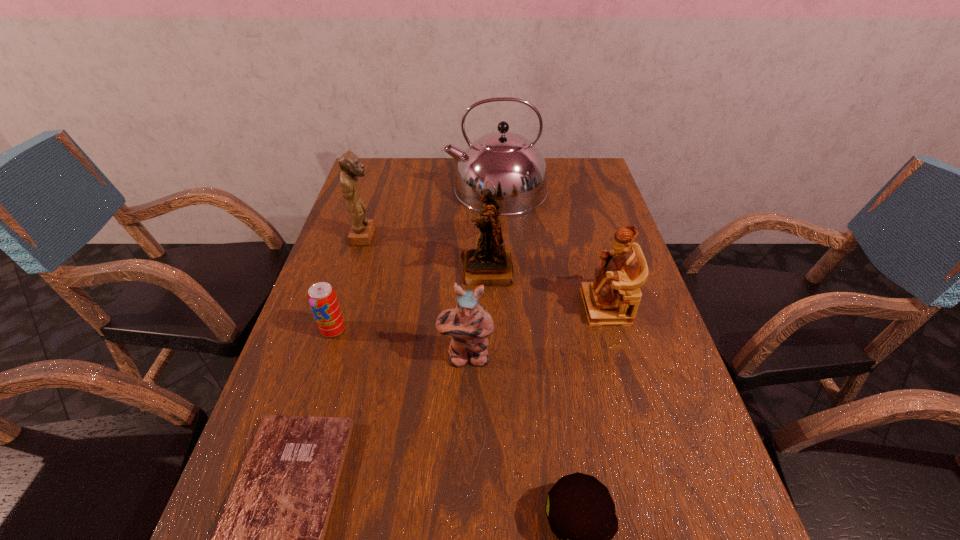
Image resolution: width=960 pixels, height=540 pixels. In order to click on blank space located on the front-facing side of the rightmost figurine in this screenshot , I will do `click(532, 307)`.

This screenshot has height=540, width=960. Find the location of `vacant space located 0.240m on the front-facing side of the rightmost figurine`. vacant space located 0.240m on the front-facing side of the rightmost figurine is located at coordinates (487, 307).

You are a GUI agent. You are given a task and a screenshot of the screen. Output one action in this format:
    pyautogui.click(x=<x>, y=<y>)
    Task: Click on the vacant space located on the front-facing side of the rightmost figurine
    The height and width of the screenshot is (540, 960).
    Given the screenshot: What is the action you would take?
    pyautogui.click(x=451, y=307)

What are the coordinates of `free spot located 0.260m on the front-facing side of the sixth farthest object` in the screenshot? It's located at (463, 495).

Locate an element on the screen. The image size is (960, 540). vacant region located 0.370m on the back of the soda can is located at coordinates (366, 228).

Identify the location of object located at the far edge. click(516, 167).

Locate an element on the screen. The image size is (960, 540). figurine at the left edge is located at coordinates (362, 230).

Where is `soda can that is positioned at the left edge`? The width and height of the screenshot is (960, 540). soda can that is positioned at the left edge is located at coordinates (322, 297).

This screenshot has width=960, height=540. I want to click on object located in the right edge section of the desktop, so click(613, 298).

Locate an element on the screen. vacant space at the far edge of the desktop is located at coordinates (x=433, y=185).